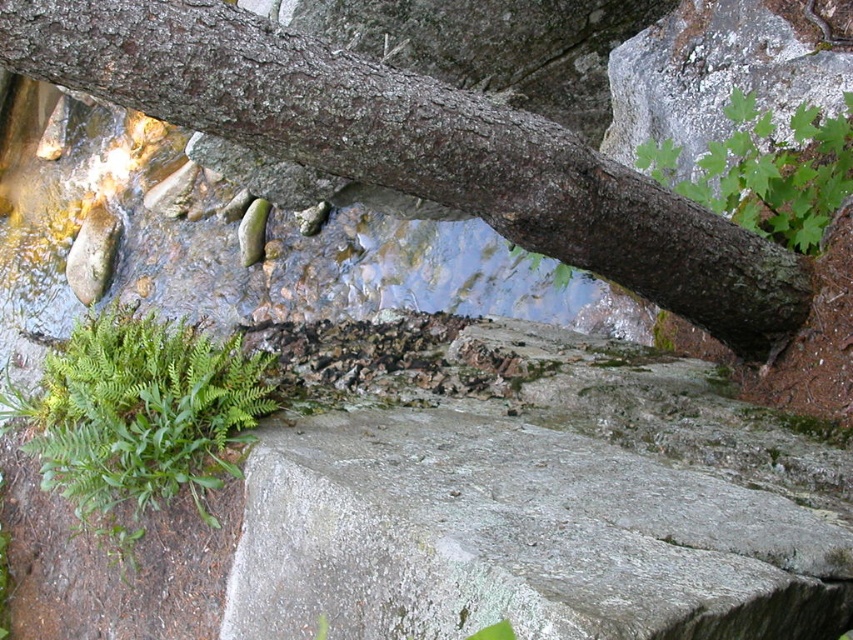
Question: Can you confirm if gray rough concrete at center is positioned below green leafy fern at upper right?

Choices:
 (A) no
 (B) yes

Answer: (B)

Question: Which object is positioned farthest from the green leafy fern at upper right?

Choices:
 (A) gray rough concrete at center
 (B) smooth brown tree trunk at upper center

Answer: (A)

Question: Is gray rough concrete at center wider than smooth brown tree trunk at upper center?

Choices:
 (A) no
 (B) yes

Answer: (A)

Question: Can you confirm if gray rough concrete at center is positioned to the right of smooth brown tree trunk at upper center?

Choices:
 (A) no
 (B) yes

Answer: (B)

Question: Which point is closer to the camera?

Choices:
 (A) smooth brown tree trunk at upper center
 (B) green leafy fern at upper right

Answer: (A)

Question: Which point is closer to the camera?

Choices:
 (A) (814, 164)
 (B) (177, 67)
 (C) (247, 525)

Answer: (B)